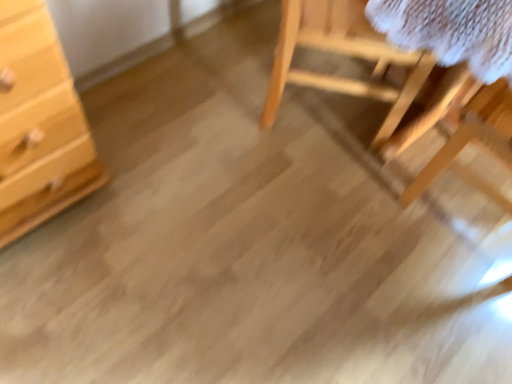
The width and height of the screenshot is (512, 384). Find the location of `vacant space that is to the left of wooden table at right`. vacant space that is to the left of wooden table at right is located at coordinates (365, 205).